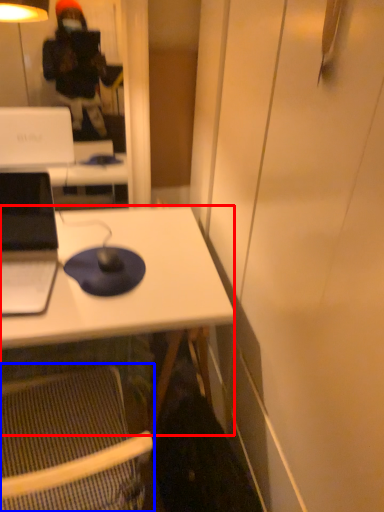
Question: Which point is closer to the camera, desk (highlighted by a red box) or folding chair (highlighted by a blue box)?

Choices:
 (A) desk
 (B) folding chair

Answer: (B)